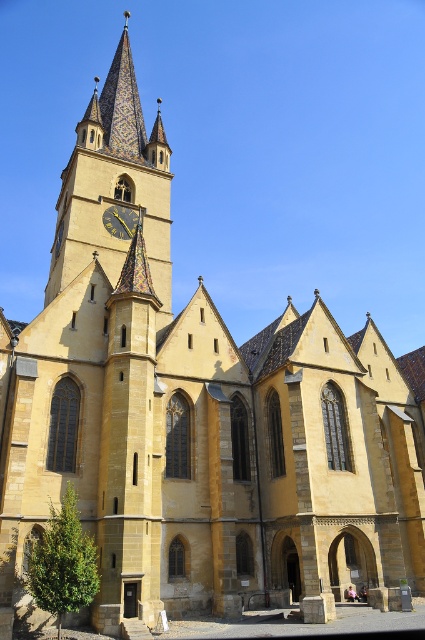
Who is taller, golden mosaic spire at upper center or gold textured clock at upper center?

golden mosaic spire at upper center

Does golden mosaic spire at upper center appear on the right side of gold textured clock at upper center?

Incorrect, golden mosaic spire at upper center is not on the right side of gold textured clock at upper center.

Which is in front, point (48, 284) or point (125, 234)?

Point (125, 234) is more forward.

I want to click on golden mosaic spire at upper center, so click(x=113, y=188).